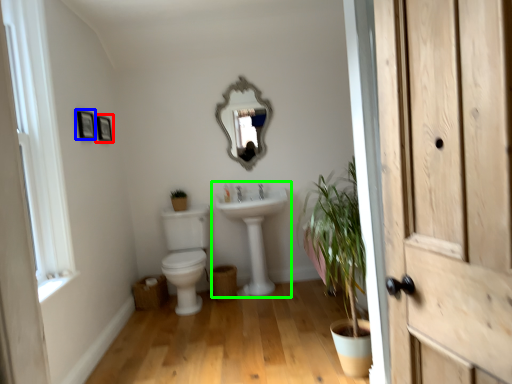
Question: Estimate the real-world distances between objects in this image. Which object is closer to picture frame (highlighted by a red box), picture frame (highlighted by a blue box) or sink (highlighted by a green box)?

Choices:
 (A) picture frame
 (B) sink

Answer: (A)